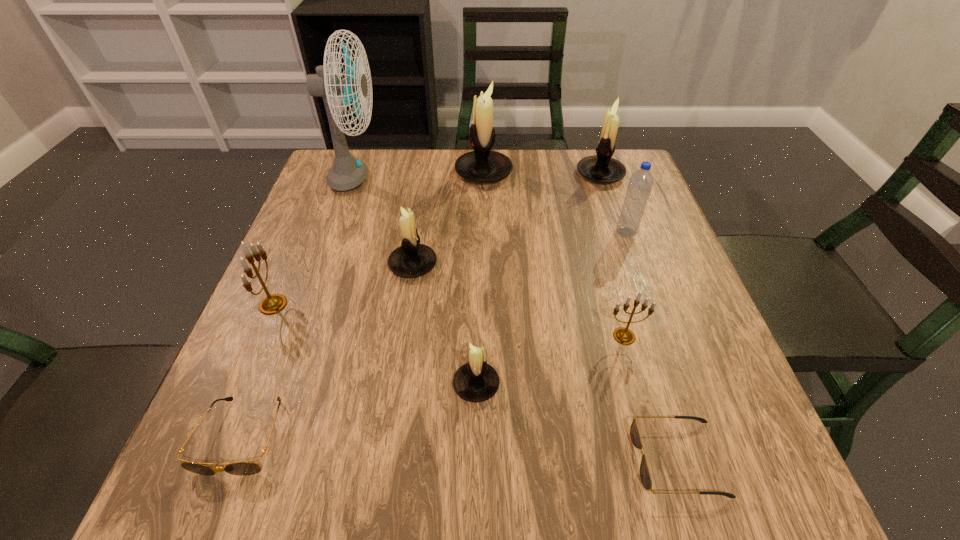
You are a GUI agent. You are given a task and a screenshot of the screen. Output one action in this format:
    pyautogui.click(x=<x>, y=<y>)
    Task: Click on the second closest white candle holder to the seventh farthest object
    The height and width of the screenshot is (540, 960).
    Given the screenshot: What is the action you would take?
    pyautogui.click(x=412, y=259)

At what (x,y) coordinates should I click in order to perform the action: click on white candle holder that is the third closest to the left black sunglasses. Please return your answer as a coordinate pair (x, y). This screenshot has height=540, width=960. Looking at the image, I should click on (482, 165).

In order to click on vacant space that satisfies the following two spatial constraints: 1. on the front-facing side of the nearest white candle holder; 2. on the left side of the fan in this screenshot , I will do `click(284, 384)`.